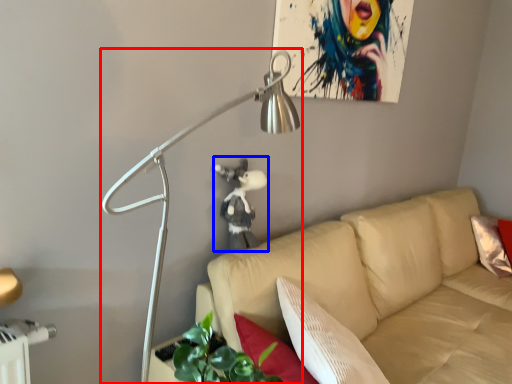
Question: Among these objects, which one is nearest to the camera, lamp (highlighted by a red box) or person (highlighted by a blue box)?

Choices:
 (A) lamp
 (B) person

Answer: (A)